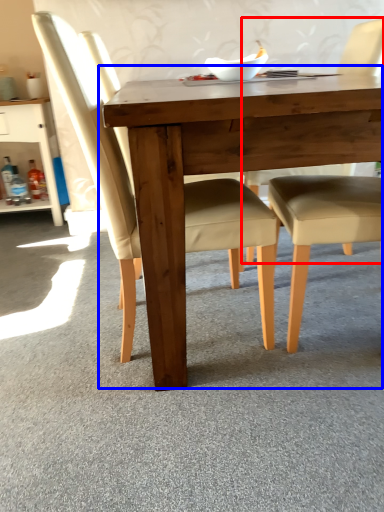
Question: Which object is closer to the camera taking this photo, chair (highlighted by a red box) or table (highlighted by a blue box)?

Choices:
 (A) chair
 (B) table

Answer: (B)